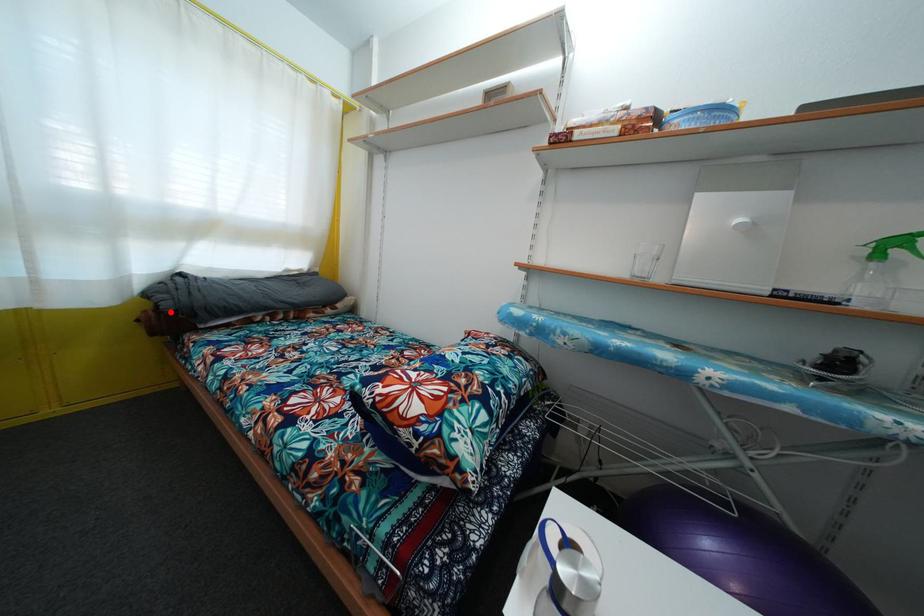
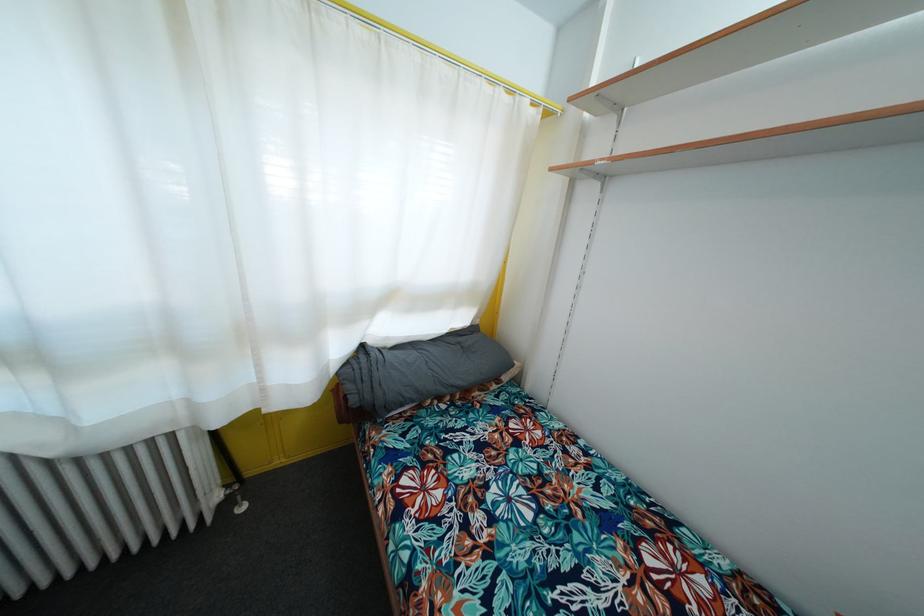
Find the pixel in the second image that matches the highlighted location in the first image.

(358, 407)